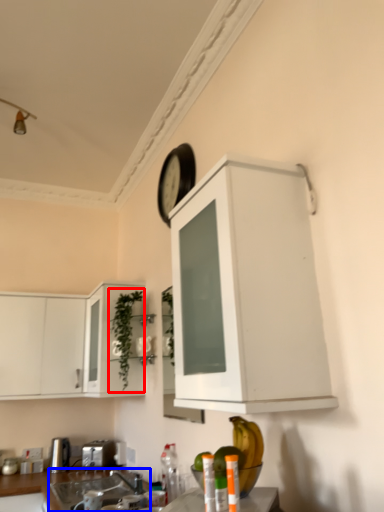
Question: Among these objects, which one is nearest to the camera, plant (highlighted by a red box) or sink (highlighted by a blue box)?

Choices:
 (A) plant
 (B) sink

Answer: (B)